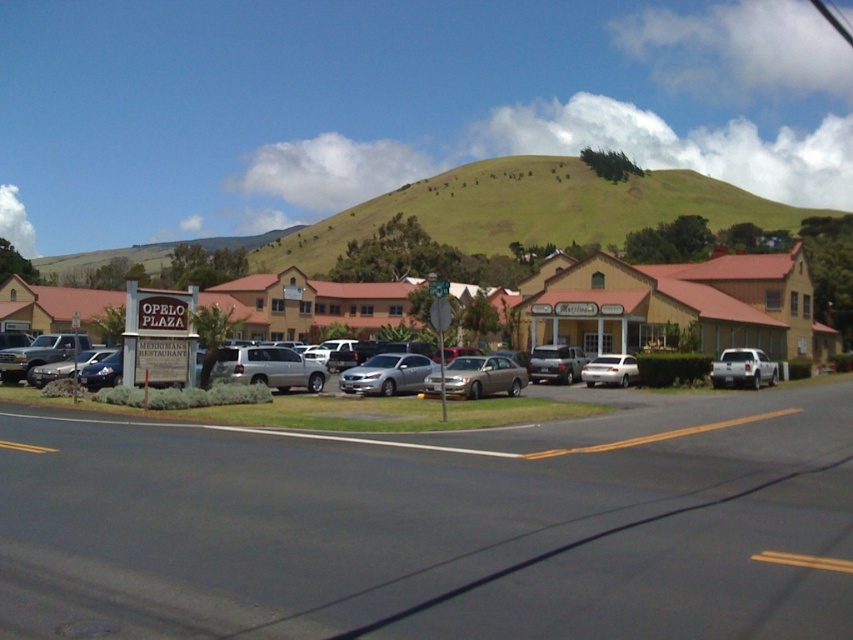
Question: Can you confirm if brown wooden motel at center is positioned above silver metallic sedan at center?

Choices:
 (A) yes
 (B) no

Answer: (A)

Question: Considering the real-world distances, which object is closest to the white matte sedan at center?

Choices:
 (A) silver metallic sedan at center
 (B) beige stucco building at center
 (C) green grassy hillside at upper center

Answer: (A)

Question: Is satin silver suv at center bigger than silver metallic sedan at center?

Choices:
 (A) yes
 (B) no

Answer: (B)

Question: Observing the image, what is the correct spatial positioning of brown wooden motel at center in reference to matte silver sedan at lower left?

Choices:
 (A) left
 (B) right

Answer: (B)

Question: Which object is the farthest from the silver metallic sedan at center?

Choices:
 (A) matte silver sedan at lower left
 (B) white matte truck at center-right
 (C) white matte sedan at center

Answer: (B)

Question: Which point appears closest to the camera in this image?

Choices:
 (A) (366, 378)
 (B) (619, 308)
 (C) (468, 365)
 (D) (289, 376)

Answer: (A)